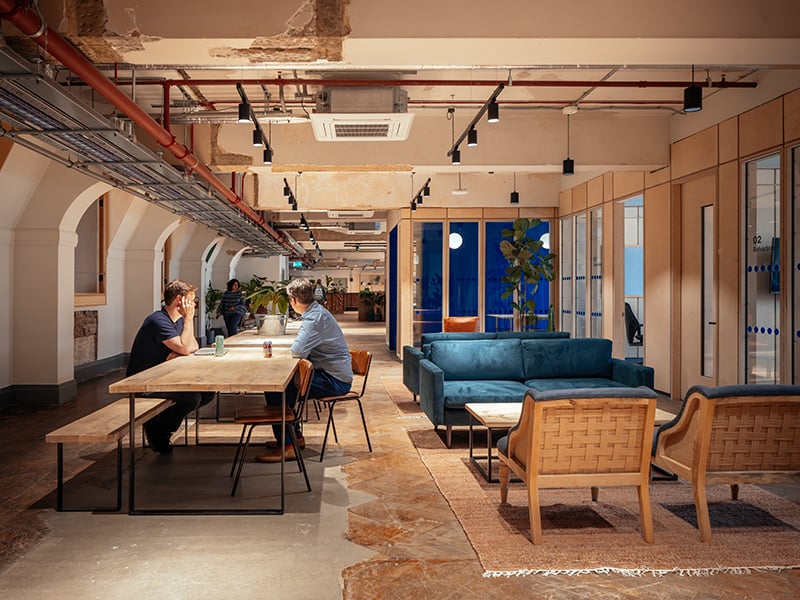
Where is `door`? This screenshot has width=800, height=600. door is located at coordinates (713, 283).